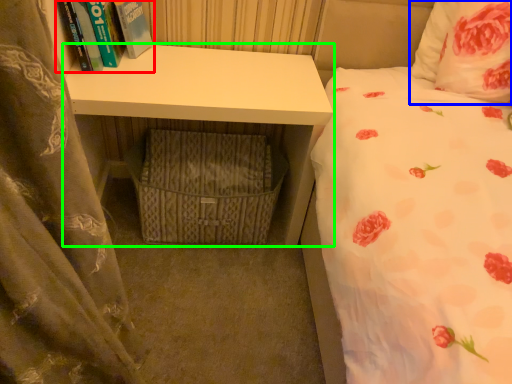
Question: Estimate the real-world distances between objects in this image. Which object is closer to book (highlighted by a red box), pillow (highlighted by a blue box) or desk (highlighted by a green box)?

Choices:
 (A) pillow
 (B) desk

Answer: (B)